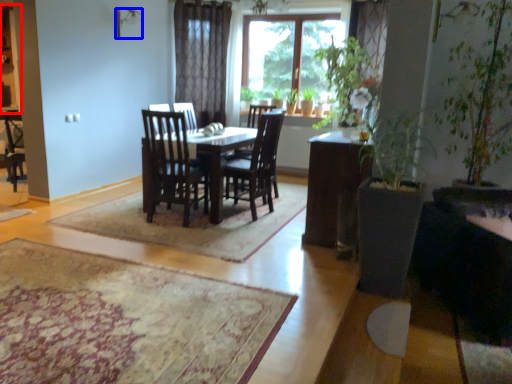
Question: Which object appears farthest to the camera in this image, cabinetry (highlighted by a red box) or lamp (highlighted by a blue box)?

Choices:
 (A) cabinetry
 (B) lamp

Answer: (A)